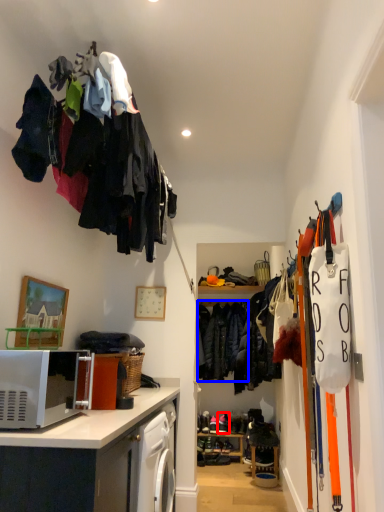
Question: Which object appears farthest to the camera in this image, footwear (highlighted by a red box) or clothing (highlighted by a blue box)?

Choices:
 (A) footwear
 (B) clothing

Answer: (A)